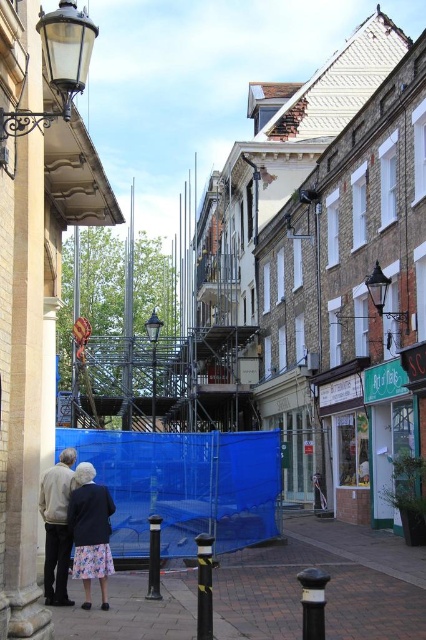
You are a delivery person standing at the entrance of the historic street. You need to deliver a package to the shop with the beige facade next to the matte black lamp post at upper left. To reach the shop, you must walk along the brick pavement at lower center. Is the path from your current position to the shop clear of obstacles?

The brick pavement at lower center is below matte black lamp post at upper left, so the path from your current position to the shop is clear of obstacles as the brick pavement is positioned below the lamp post, indicating it extends towards the shop without obstructions.

You are a delivery person needing to park your vehicle on the brick pavement at lower center. The parking spot is marked by the point at coordinates (328, 586). Can you confirm if this parking spot is on the brick pavement at lower center?

The brick pavement at lower center is represented by point (328, 586), so yes, the parking spot at those coordinates is indeed on the brick pavement at lower center.

You are a pedestrian walking on the brick pavement at lower center and notice a light gray sweater at lower left. Which object is closer to the ground?

The brick pavement at lower center is closer to the ground because it is positioned below the light gray sweater at lower left.